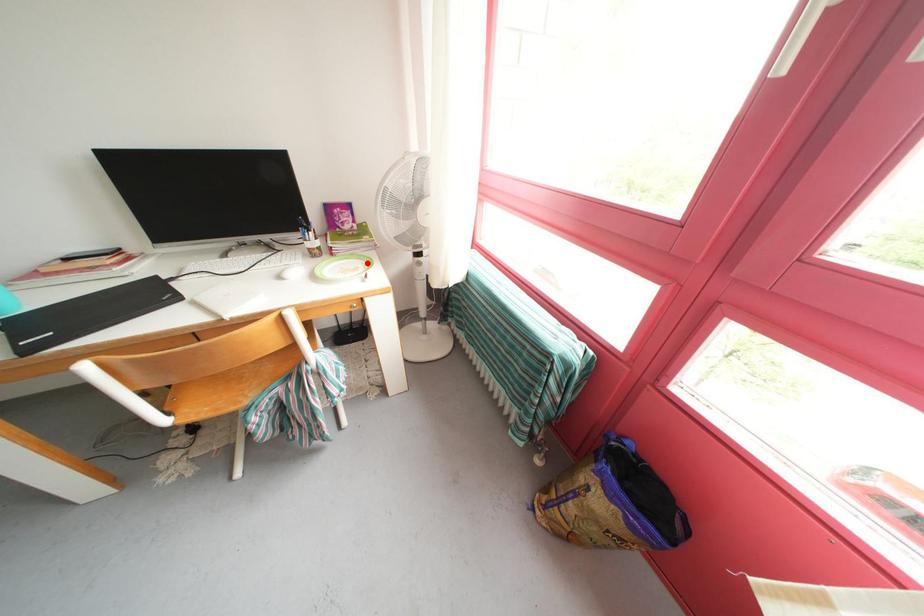
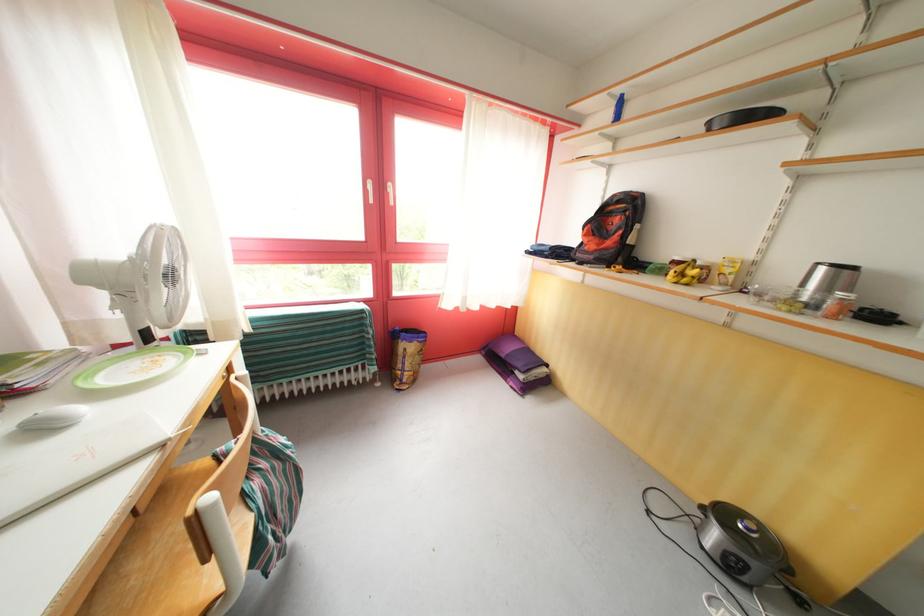
The point at the highlighted location is marked in the first image. Where is the corresponding point in the second image?

(128, 363)